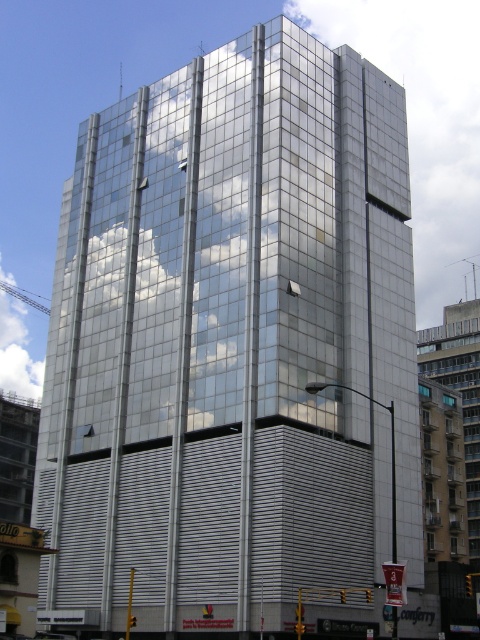
Between transparent glass cloud at center and white fluffy cloud at upper left, which one is positioned higher?

transparent glass cloud at center is above.

Can you confirm if transparent glass cloud at center is positioned to the right of white fluffy cloud at upper left?

Correct, you'll find transparent glass cloud at center to the right of white fluffy cloud at upper left.

Which is in front, point (418, 72) or point (16, 337)?

Point (16, 337) is more forward.

The width and height of the screenshot is (480, 640). I want to click on transparent glass cloud at center, so click(423, 120).